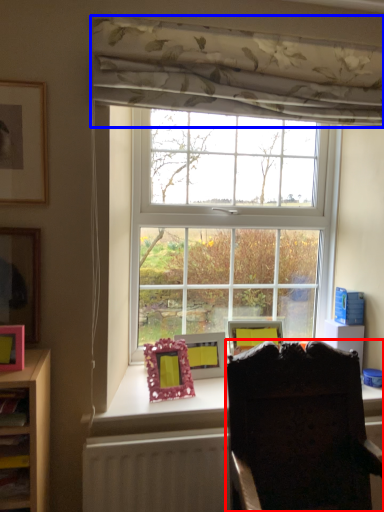
Question: Which of the following is the closest to the observer, chair (highlighted by a red box) or curtain (highlighted by a blue box)?

Choices:
 (A) chair
 (B) curtain

Answer: (A)